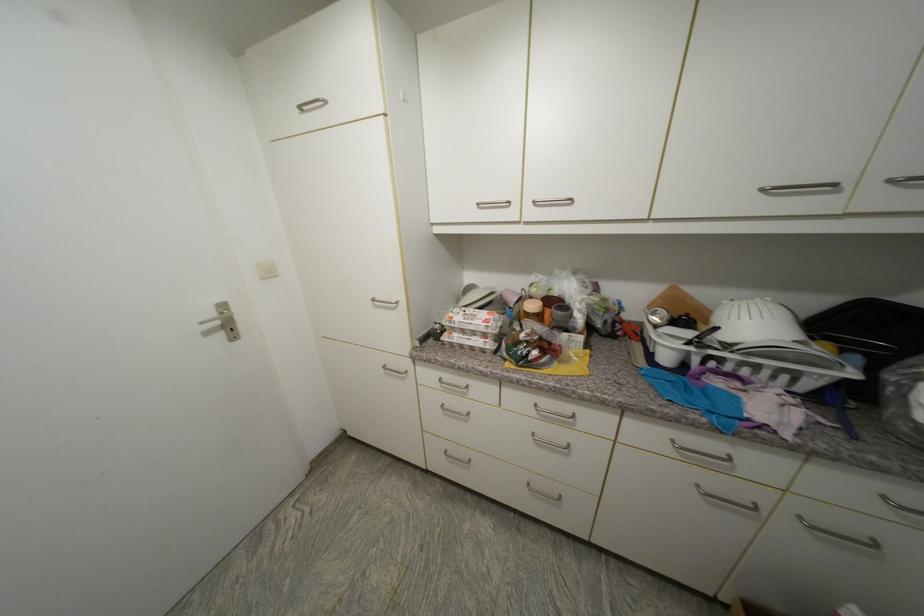
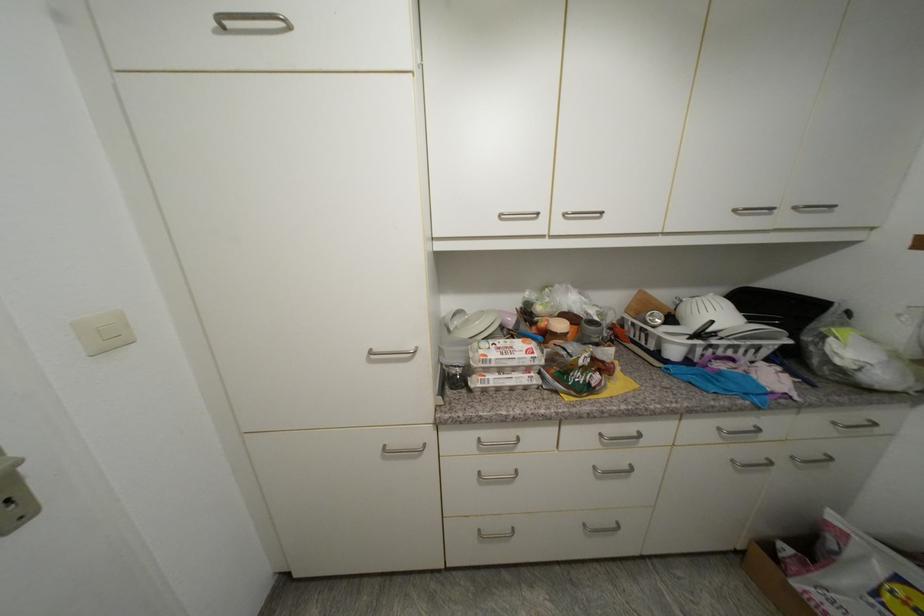
Where in the second image is the point corresponding to the point at 662,321 from the first image?

(663, 323)